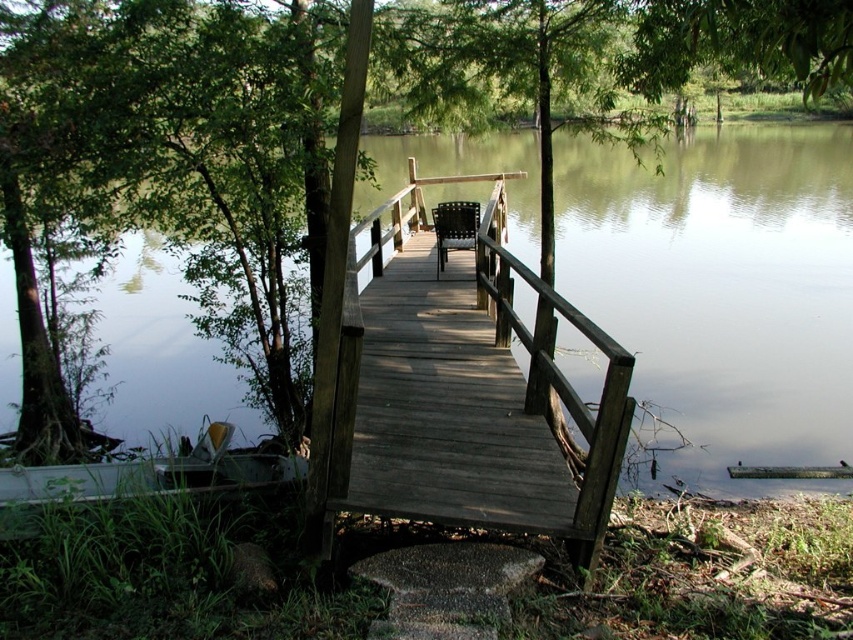
You are standing at the point labeled as point (463, 390) in the image. What object is located exactly at that point?

The point (463, 390) is where the dark wood bridge at center is located.

You are sitting on the brown woven chair at center and want to walk to the dark wood bridge at center. Which direction should you move to reach it?

You should move downward to reach the dark wood bridge at center because it is located below the brown woven chair at center.

You are standing at the edge of the dock and want to take a photo of both point (x=460, y=506) and point (x=438, y=273) in the scene. Based on their positions, which point will appear larger in your camera view?

Point (x=460, y=506) will appear larger in the camera view because it is closer to the camera than point (x=438, y=273).